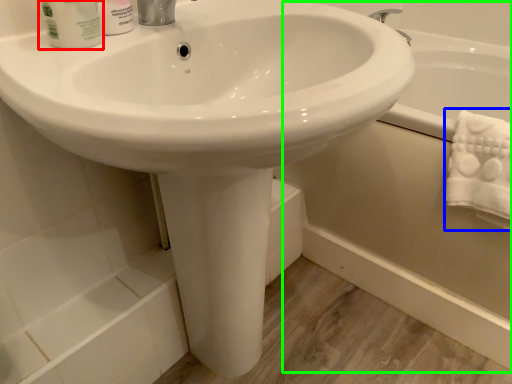
Question: Which object is positioned closest to mouthwash (highlighted by a red box)? Select from bath towel (highlighted by a blue box) and bath (highlighted by a green box).

Choices:
 (A) bath towel
 (B) bath

Answer: (A)